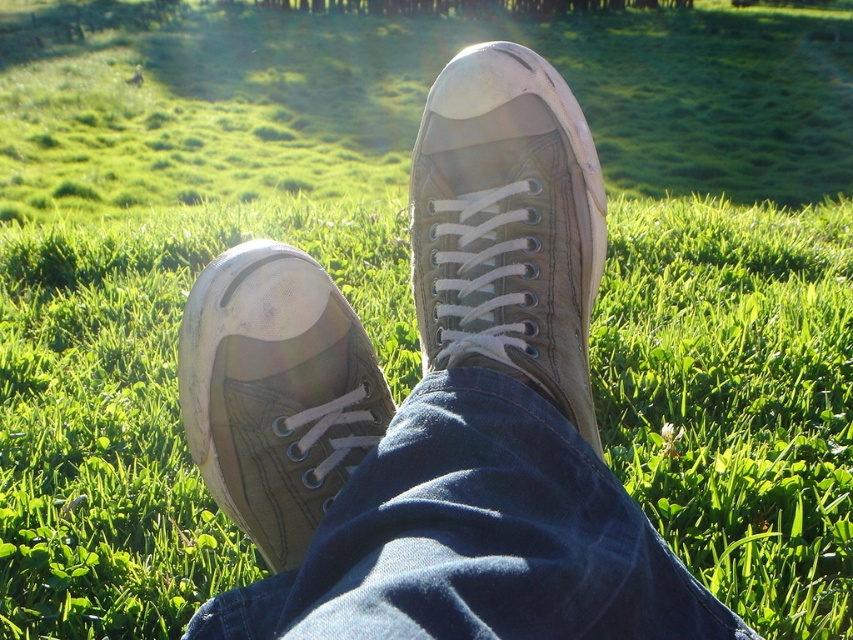
You are trying to locate the worn canvas shoe at center in the image. According to the coordinates provided, where exactly is it positioned?

The worn canvas shoe at center is located at point coordinates 0.353 in the x and 0.596 in the y axis.

You are standing in a field and want to place a 1.5 meter long wooden bench. The point where you want to place it is at point [570,236]. Can you fit the bench there?

The point at [570,236] is 1.03 meters from the viewer, so the bench cannot be placed there as it is longer than the available space.

You are trying to locate the worn canvas shoe at center and the matte brown shoe at lower left in the image. Based on their positions, which shoe is closer to the right edge of the image?

The worn canvas shoe at center is closer to the right edge of the image because it is positioned to the right of the matte brown shoe at lower left.